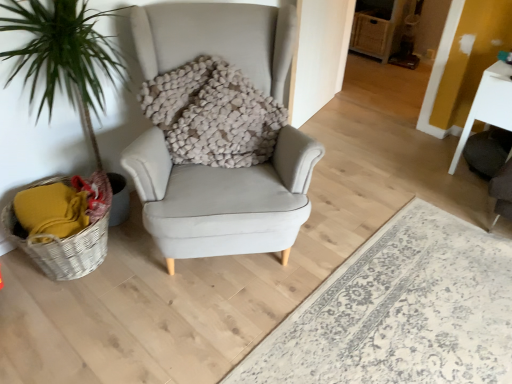
What are the coordinates of `free space in front of woven wicker basket at lower left` in the screenshot? It's located at pyautogui.click(x=66, y=327).